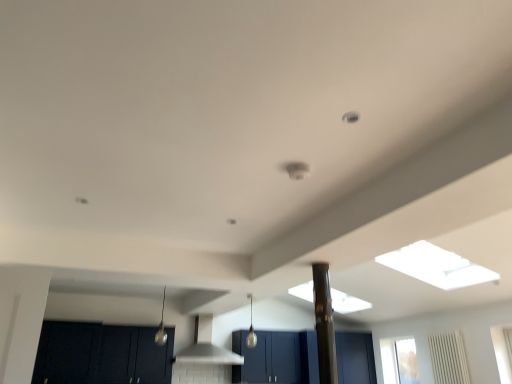
Question: From a real-world perspective, is dark wood cabinet at lower left, the first cabinetry positioned from the left, positioned above or below matte black cabinets at lower left, positioned as the 2th cabinetry in left-to-right order?

Choices:
 (A) above
 (B) below

Answer: (A)

Question: Is dark wood cabinet at lower left, the first cabinetry positioned from the left, wider or thinner than matte black cabinets at lower left, positioned as the 2th cabinetry in left-to-right order?

Choices:
 (A) thin
 (B) wide

Answer: (B)

Question: Which is farther from the black glossy pillar at center?

Choices:
 (A) matte blue cabinet at center, marked as the first cabinetry in a right-to-left arrangement
 (B) white matte vent at center
 (C) matte black cabinets at lower left, the second cabinetry positioned from the right
 (D) dark wood cabinet at lower left, the first cabinetry positioned from the left

Answer: (D)

Question: Considering the real-world distances, which object is farthest from the matte blue cabinet at center, marked as the first cabinetry in a right-to-left arrangement?

Choices:
 (A) matte black cabinets at lower left, the second cabinetry positioned from the right
 (B) white matte vent at center
 (C) dark wood cabinet at lower left, the first cabinetry positioned from the left
 (D) black glossy pillar at center

Answer: (D)